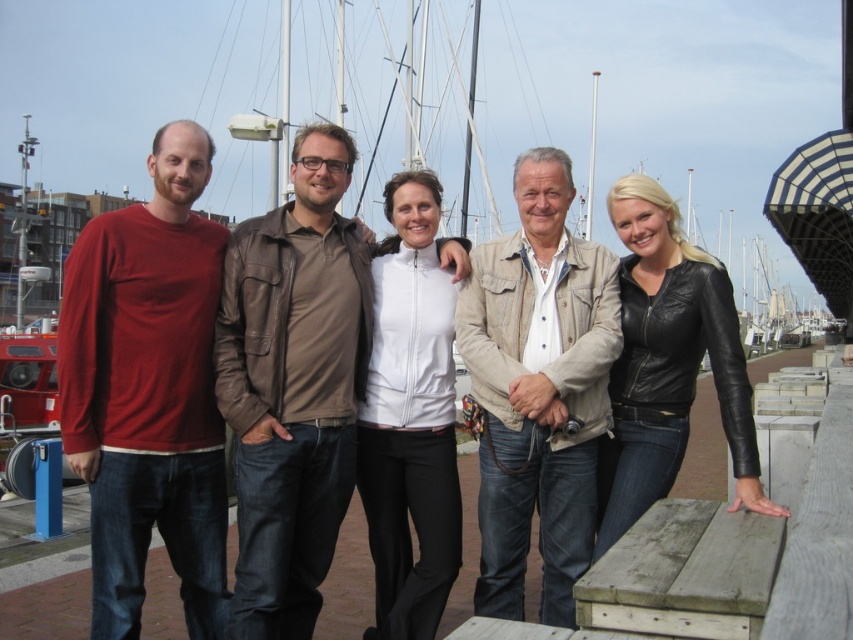
Question: Is matte black jacket at left in front of brown leather jacket at center?

Choices:
 (A) no
 (B) yes

Answer: (B)

Question: Which point is farther to the camera?

Choices:
 (A) (445, 595)
 (B) (190, 156)
 (C) (335, 280)
 (D) (635, 348)

Answer: (C)

Question: Which point is farther to the camera?

Choices:
 (A) (402, 513)
 (B) (254, 384)

Answer: (A)

Question: Considering the real-world distances, which object is closest to the matte black jacket at left?

Choices:
 (A) beige textured jacket at center
 (B) white matte jacket at center
 (C) brown leather jacket at center

Answer: (A)

Question: Can you confirm if matte red shirt at left is thinner than brown leather jacket at center?

Choices:
 (A) yes
 (B) no

Answer: (B)

Question: Can you confirm if matte red shirt at left is positioned above white matte jacket at center?

Choices:
 (A) no
 (B) yes

Answer: (A)